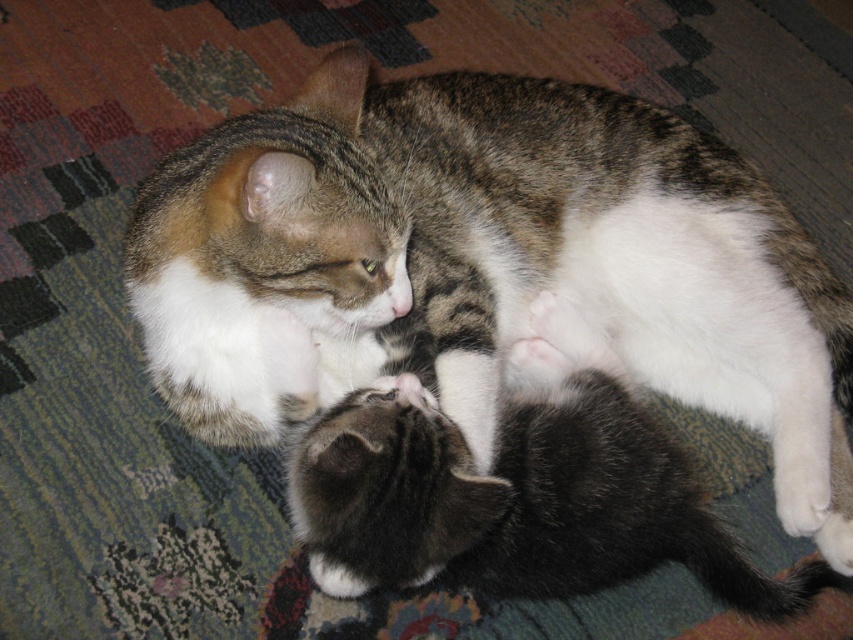
Which is above, tabby fur cat at center or soft gray fur kitten at lower center?

tabby fur cat at center is higher up.

Between tabby fur cat at center and soft gray fur kitten at lower center, which one has more height?

With more height is tabby fur cat at center.

Who is more distant from viewer, (576, 177) or (352, 452)?

The point (576, 177) is behind.

The height and width of the screenshot is (640, 853). Find the location of `tabby fur cat at center`. tabby fur cat at center is located at coordinates (486, 262).